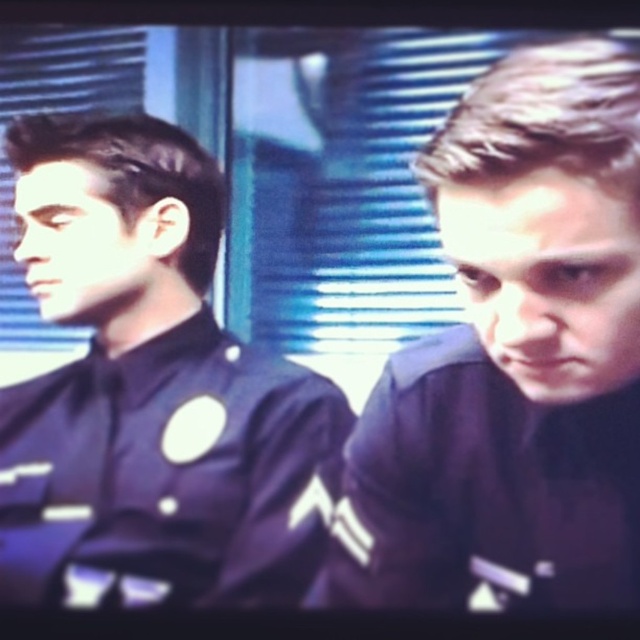
You are designing a new police station layout and need to place two desks for the officers wearing the matte black uniform at left and dark blue uniform at right. Given their uniform sizes, which desk should be wider to accommodate their clothing?

The desk for the matte black uniform at left should be wider since its width is larger than the dark blue uniform at right.

You are a prop designer working on a film set. You need to place a 6 inch wide decorative plaque between the two officers wearing the matte black uniform at left and dark blue uniform at right. Is there enough space to fit the plaque without moving the officers?

The matte black uniform at left and dark blue uniform at right are 7.43 inches apart, so yes, the 6 inch wide decorative plaque can fit between them since the distance between the uniforms is greater than the plaque width.

You are a costume designer preparing for a scene where two police officers must stand side by side. The script requires that the officer in the matte black uniform at left appears more authoritative than the one in the dark blue uniform at right. Based on the given image, how can you use their height difference to achieve this effect?

The matte black uniform at left is taller than the dark blue uniform at right. To emphasize authority, position the officer in the matte black uniform at left higher in the frame so their taller stature visually reinforces their authoritative presence compared to the shorter dark blue uniform at right.